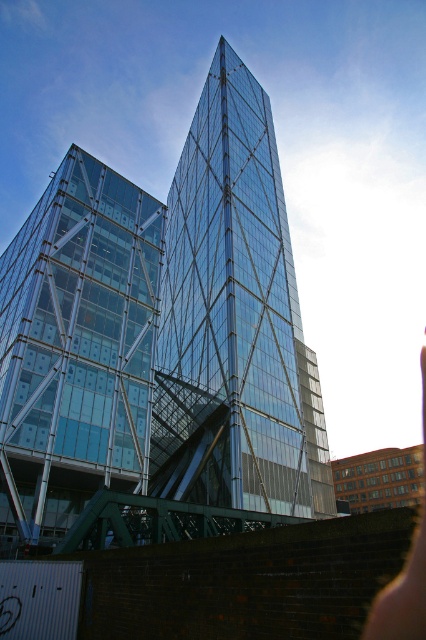
Can you confirm if transparent glass tower at center is positioned to the right of skinny pinkish skin at lower right?

In fact, transparent glass tower at center is to the left of skinny pinkish skin at lower right.

Who is positioned more to the left, transparent glass tower at center or skinny pinkish skin at lower right?

transparent glass tower at center is more to the left.

Does point (282, 250) come closer to viewer compared to point (414, 620)?

No, it is not.

Identify the location of transparent glass tower at center. The width and height of the screenshot is (426, 640). (233, 321).

Does transparent glass tower at center have a lesser width compared to pink skin at lower right?

Correct, transparent glass tower at center's width is less than pink skin at lower right's.

Consider the image. Is transparent glass tower at center wider than pink skin at lower right?

In fact, transparent glass tower at center might be narrower than pink skin at lower right.

Locate an element on the screen. Image resolution: width=426 pixels, height=640 pixels. transparent glass tower at center is located at coordinates (233, 321).

Find the location of a particular element. transparent glass tower at center is located at coordinates (233, 321).

Can you confirm if transparent glass building at left is positioned to the right of skinny pinkish skin at lower right?

In fact, transparent glass building at left is to the left of skinny pinkish skin at lower right.

Looking at this image, does transparent glass building at left have a lesser height compared to skinny pinkish skin at lower right?

Correct, transparent glass building at left is not as tall as skinny pinkish skin at lower right.

This screenshot has height=640, width=426. Describe the element at coordinates (77, 348) in the screenshot. I see `transparent glass building at left` at that location.

At what (x,y) coordinates should I click in order to perform the action: click on transparent glass building at left. Please return your answer as a coordinate pair (x, y). The image size is (426, 640). Looking at the image, I should click on (77, 348).